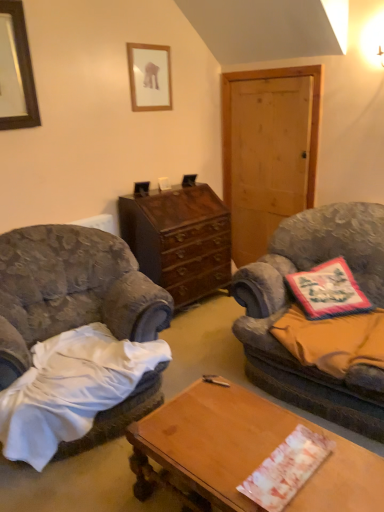
What do you see at coordinates (328, 291) in the screenshot?
I see `floral fabric pillow at right` at bounding box center [328, 291].

Describe the element at coordinates (179, 239) in the screenshot. I see `dark brown wood cabinet at center` at that location.

The image size is (384, 512). What are the coordinates of `wooden framed picture at upper center, the second picture frame positioned from the left` in the screenshot? It's located at (149, 77).

Describe the element at coordinates (294, 302) in the screenshot. I see `velvet fabric couch at right` at that location.

Image resolution: width=384 pixels, height=512 pixels. Describe the element at coordinates (16, 70) in the screenshot. I see `black wooden picture frame at upper left, which is the second picture frame in back-to-front order` at that location.

Locate an element on the screen. Image resolution: width=384 pixels, height=512 pixels. floral fabric pillow at right is located at coordinates (328, 291).

Would you say dark brown wood cabinet at center is to the left or to the right of floral fabric pillow at right in the picture?

Clearly, dark brown wood cabinet at center is on the left of floral fabric pillow at right in the image.

Can you confirm if dark brown wood cabinet at center is smaller than floral fabric pillow at right?

No, dark brown wood cabinet at center is not smaller than floral fabric pillow at right.

From the image's perspective, which one is positioned lower, dark brown wood cabinet at center or floral fabric pillow at right?

floral fabric pillow at right, from the image's perspective.

Is dark brown wood cabinet at center positioned far away from floral fabric pillow at right?

That's right, there is a large distance between dark brown wood cabinet at center and floral fabric pillow at right.

Does floral fabric pillow at right have a greater height compared to white paper at center, the 2th sheet from the top?

Yes, floral fabric pillow at right is taller than white paper at center, the 2th sheet from the top.

Would you consider floral fabric pillow at right to be distant from white paper at center, acting as the first sheet starting from the bottom?

No, floral fabric pillow at right is not far away from white paper at center, acting as the first sheet starting from the bottom.

From a real-world perspective, relative to white paper at center, the 1th sheet viewed from the front, is floral fabric pillow at right vertically above or below?

From a real-world perspective, floral fabric pillow at right is physically above white paper at center, the 1th sheet viewed from the front.

Can we say floral fabric pillow at right lies outside white paper at center, acting as the first sheet starting from the bottom?

That's correct, floral fabric pillow at right is outside of white paper at center, acting as the first sheet starting from the bottom.

Considering the relative positions of black wooden picture frame at upper left, the first picture frame positioned from the front, and floral fabric pillow at right in the image provided, is black wooden picture frame at upper left, the first picture frame positioned from the front, to the right of floral fabric pillow at right from the viewer's perspective?

In fact, black wooden picture frame at upper left, the first picture frame positioned from the front, is to the left of floral fabric pillow at right.

Which is less distant, (17, 48) or (322, 287)?

The point (322, 287) is more forward.

In the scene shown: From the image's perspective, is black wooden picture frame at upper left, which is the second picture frame in back-to-front order, located above floral fabric pillow at right?

Yes, from the image's perspective, black wooden picture frame at upper left, which is the second picture frame in back-to-front order, is above floral fabric pillow at right.

Considering the sizes of objects orange fabric pillow at right, placed as the second sheet when sorted from bottom to top, and white paper at center, acting as the first sheet starting from the bottom, in the image provided, who is smaller, orange fabric pillow at right, placed as the second sheet when sorted from bottom to top, or white paper at center, acting as the first sheet starting from the bottom,?

white paper at center, acting as the first sheet starting from the bottom, is smaller.

Is orange fabric pillow at right, placed as the second sheet when sorted from bottom to top, facing towards white paper at center, the 2th sheet from the top?

Yes, orange fabric pillow at right, placed as the second sheet when sorted from bottom to top, is turned towards white paper at center, the 2th sheet from the top.

Considering the points (300, 362) and (261, 490), which point is behind, point (300, 362) or point (261, 490)?

The point (300, 362) is farther.

Does orange fabric pillow at right, the second sheet positioned from the front, come behind white paper at center, acting as the first sheet starting from the bottom?

Yes, it is behind white paper at center, acting as the first sheet starting from the bottom.

Does white paper at center, acting as the first sheet starting from the bottom, have a greater height compared to dark brown wood cabinet at center?

Incorrect, the height of white paper at center, acting as the first sheet starting from the bottom, is not larger of that of dark brown wood cabinet at center.

Does point (296, 478) come behind point (181, 293)?

That is False.

Where is `sheet that is the 2nd one below the dark brown wood cabinet at center (from a real-world perspective)`? This screenshot has width=384, height=512. sheet that is the 2nd one below the dark brown wood cabinet at center (from a real-world perspective) is located at coordinates (286, 469).

Is white paper at center, the 2th sheet from the top, facing away from dark brown wood cabinet at center?

No, white paper at center, the 2th sheet from the top,'s orientation is not away from dark brown wood cabinet at center.

Is velvet fabric couch at right located outside wooden framed picture at upper center, which is the 2th picture frame from front to back?

Absolutely, velvet fabric couch at right is external to wooden framed picture at upper center, which is the 2th picture frame from front to back.

Does point (382, 237) come closer to viewer compared to point (168, 105)?

Yes, it is.

Is velvet fabric couch at right turned away from wooden framed picture at upper center, which is the 1th picture frame from back to front?

That's not correct — velvet fabric couch at right is not looking away from wooden framed picture at upper center, which is the 1th picture frame from back to front.

Is velvet gray armchair at left shorter than black wooden picture frame at upper left, arranged as the 2th picture frame when viewed from the right?

Incorrect, the height of velvet gray armchair at left does not fall short of that of black wooden picture frame at upper left, arranged as the 2th picture frame when viewed from the right.

You are a GUI agent. You are given a task and a screenshot of the screen. Output one action in this format:
    pyautogui.click(x=<x>, y=<y>)
    Task: Click on the chair below the black wooden picture frame at upper left, arranged as the 2th picture frame when viewed from the right (from the image's perspective)
    The height and width of the screenshot is (512, 384).
    Given the screenshot: What is the action you would take?
    pyautogui.click(x=74, y=340)

Are velvet gray armchair at left and black wooden picture frame at upper left, which is the second picture frame in back-to-front order, located far from each other?

Yes, velvet gray armchair at left and black wooden picture frame at upper left, which is the second picture frame in back-to-front order, are located far from each other.

Identify the location of pillow that appears below the dark brown wood cabinet at center (from the image's perspective). This screenshot has height=512, width=384. (328, 291).

Locate an element on the screen. sheet that is the 2nd object located in front of the floral fabric pillow at right is located at coordinates (286, 469).

Considering their positions, is floral fabric pillow at right positioned closer to orange fabric pillow at right, placed as the second sheet when sorted from bottom to top, than wooden desk at center?

Among the two, floral fabric pillow at right is located nearer to orange fabric pillow at right, placed as the second sheet when sorted from bottom to top.

Looking at the image, which one is located closer to orange fabric pillow at right, the first sheet positioned from the back, floral fabric pillow at right or dark brown wood cabinet at center?

floral fabric pillow at right is positioned closer to the anchor orange fabric pillow at right, the first sheet positioned from the back.

Looking at the image, which one is located further to wooden framed picture at upper center, the second picture frame positioned from the left, black wooden picture frame at upper left, the first picture frame positioned from the front, or orange fabric pillow at right, acting as the 1th sheet starting from the top?

orange fabric pillow at right, acting as the 1th sheet starting from the top, is further to wooden framed picture at upper center, the second picture frame positioned from the left.

Which object lies nearer to the anchor point floral fabric pillow at right, wooden desk at center or black wooden picture frame at upper left, arranged as the 2th picture frame when viewed from the right?

wooden desk at center is positioned closer to the anchor floral fabric pillow at right.

From the image, which object appears to be farther from wooden framed picture at upper center, arranged as the first picture frame when viewed from the right, velvet gray armchair at left or floral fabric pillow at right?

floral fabric pillow at right.

Estimate the real-world distances between objects in this image. Which object is further from dark brown wood cabinet at center, orange fabric pillow at right, the first sheet positioned from the back, or wooden framed picture at upper center, arranged as the first picture frame when viewed from the right?

orange fabric pillow at right, the first sheet positioned from the back, is positioned further to the anchor dark brown wood cabinet at center.

Which object lies further to the anchor point orange fabric pillow at right, placed as the second sheet when sorted from bottom to top, wooden desk at center or white paper at center, the 2th sheet from the top?

white paper at center, the 2th sheet from the top, is further to orange fabric pillow at right, placed as the second sheet when sorted from bottom to top.

Based on their spatial positions, is dark brown wood cabinet at center or velvet fabric couch at right further from orange fabric pillow at right, acting as the 1th sheet starting from the top?

dark brown wood cabinet at center lies further to orange fabric pillow at right, acting as the 1th sheet starting from the top, than the other object.

This screenshot has width=384, height=512. Find the location of `cabinetry between black wooden picture frame at upper left, the first picture frame positioned from the left, and floral fabric pillow at right`. cabinetry between black wooden picture frame at upper left, the first picture frame positioned from the left, and floral fabric pillow at right is located at coordinates (179, 239).

At what (x,y) coordinates should I click in order to perform the action: click on pillow between orange fabric pillow at right, the first sheet positioned from the back, and dark brown wood cabinet at center, along the z-axis. Please return your answer as a coordinate pair (x, y). This screenshot has width=384, height=512. Looking at the image, I should click on (328, 291).

Locate an element on the screen. Image resolution: width=384 pixels, height=512 pixels. studio couch that lies between wooden framed picture at upper center, which is the 2th picture frame from front to back, and velvet gray armchair at left from top to bottom is located at coordinates (294, 302).

Identify the location of picture frame between wooden framed picture at upper center, the second picture frame positioned from the left, and dark brown wood cabinet at center, in the vertical direction. This screenshot has width=384, height=512. (16, 70).